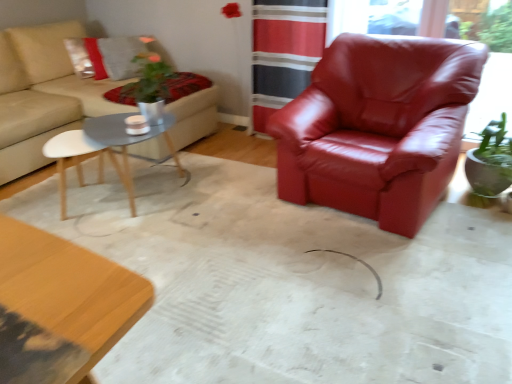
Question: Based on their positions, is velvet red blanket at upper left located to the left or right of beige fabric couch at upper left?

Choices:
 (A) left
 (B) right

Answer: (B)

Question: From a real-world perspective, relative to beige fabric couch at upper left, is velvet red blanket at upper left vertically above or below?

Choices:
 (A) below
 (B) above

Answer: (B)

Question: Which object is positioned farthest from the glossy leather armchair at right?

Choices:
 (A) velvet red blanket at upper left
 (B) satin red armchair at center
 (C) matte gray wood coffee table at center-left
 (D) red leather armchair at center
 (E) beige fabric couch at upper left

Answer: (C)

Question: Which is nearer to the glossy leather armchair at right?

Choices:
 (A) beige fabric couch at upper left
 (B) satin red armchair at center
 (C) velvet red blanket at upper left
 (D) matte gray wood coffee table at center-left
 (E) red leather armchair at center

Answer: (E)